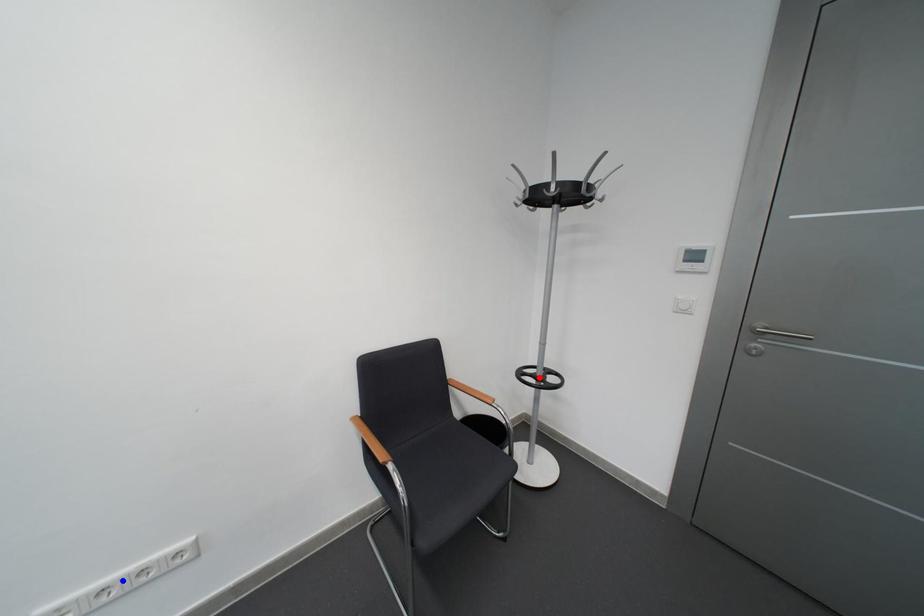
Question: In the image, two points are highlighted. Which point is nearer to the camera? Reply with the corresponding letter.

Choices:
 (A) blue point
 (B) red point

Answer: (A)